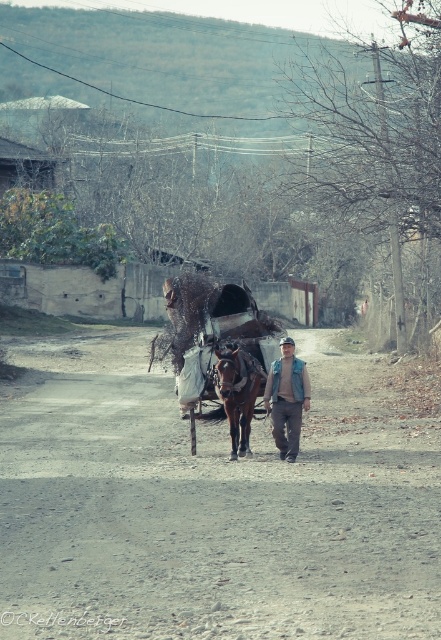
Can you confirm if brown gravel dirt track at center is smaller than brown glossy horse at center?

No, brown gravel dirt track at center is not smaller than brown glossy horse at center.

Who is lower down, brown gravel dirt track at center or brown glossy horse at center?

Positioned lower is brown gravel dirt track at center.

Does point (415, 552) come in front of point (250, 419)?

Yes.

Locate an element on the screen. The image size is (441, 640). brown gravel dirt track at center is located at coordinates (210, 506).

Does brown gravel dirt track at center appear on the right side of denim jacket at center?

In fact, brown gravel dirt track at center is to the left of denim jacket at center.

Does point (231, 504) come farther from viewer compared to point (272, 419)?

That is False.

Where is `brown gravel dirt track at center`? Image resolution: width=441 pixels, height=640 pixels. brown gravel dirt track at center is located at coordinates (210, 506).

Which is below, brown leather horse cart at center or denim jacket at center?

Positioned lower is denim jacket at center.

Is brown leather horse cart at center shorter than denim jacket at center?

Yes.

Does point (191, 337) come closer to viewer compared to point (298, 404)?

No, (191, 337) is further to viewer.

Locate an element on the screen. This screenshot has width=441, height=640. brown leather horse cart at center is located at coordinates (219, 346).